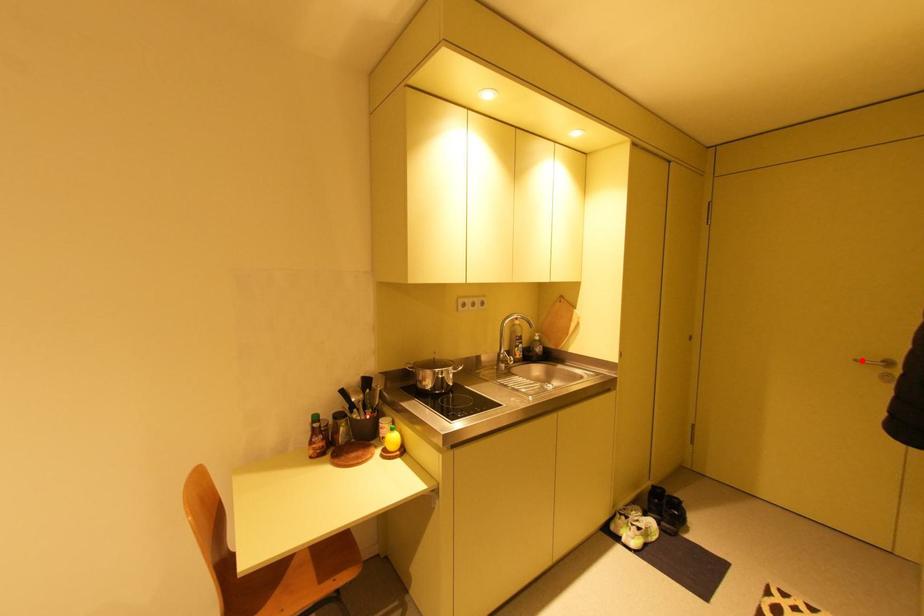
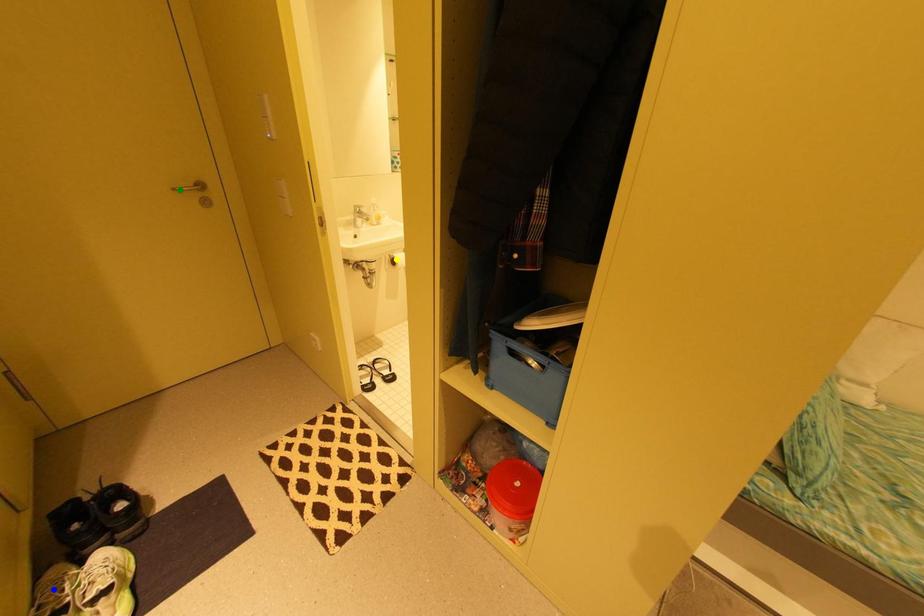
Question: I am providing you with two images of the same scene from different viewpoints. A red point is marked on the first image. You are given multiple points on the second image. Which point in image 2 is actually the same real-world point as the red point in image 1?

Choices:
 (A) yellow point
 (B) blue point
 (C) green point

Answer: (C)